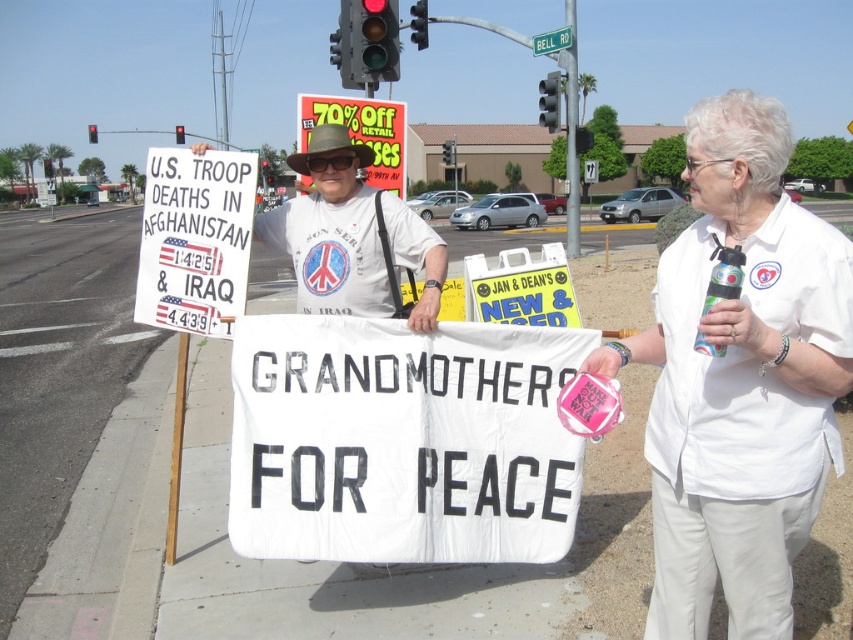
You are a photographer trying to capture both the white fabric shirt at center and the white plastic street sign at upper center in the same frame. Given their sizes, which object would you need to position closer to the camera to ensure both fit within the frame?

The white fabric shirt at center is wider than the white plastic street sign at upper center. To include both in the frame, position the white plastic street sign at upper center closer to the camera since it is narrower, allowing the wider shirt to remain in the background without cropping.

You are a photographer trying to capture the protestor holding the banner. You notice the white fabric shirt at center and the white fabric banner at center. Which object is closer to the camera?

The white fabric shirt at center is positioned over the white fabric banner at center, meaning the shirt is closer to the camera.